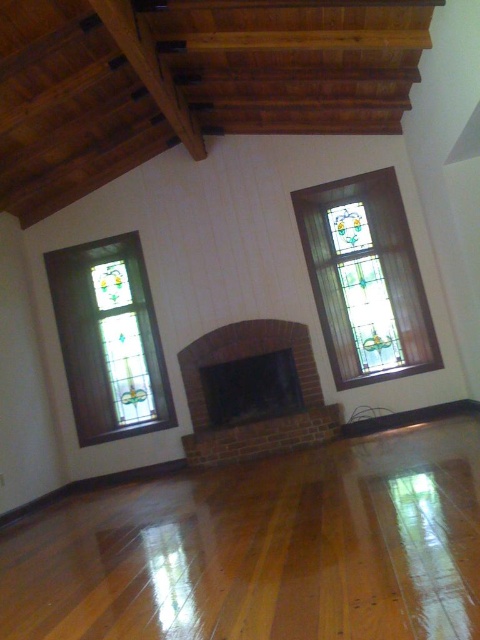
You are standing in the center of the room and want to look at the stained glass window at center. In which direction should you turn your head?

The stained glass window at center is located at point (365, 278), so you should look slightly to the right and upwards to see it.